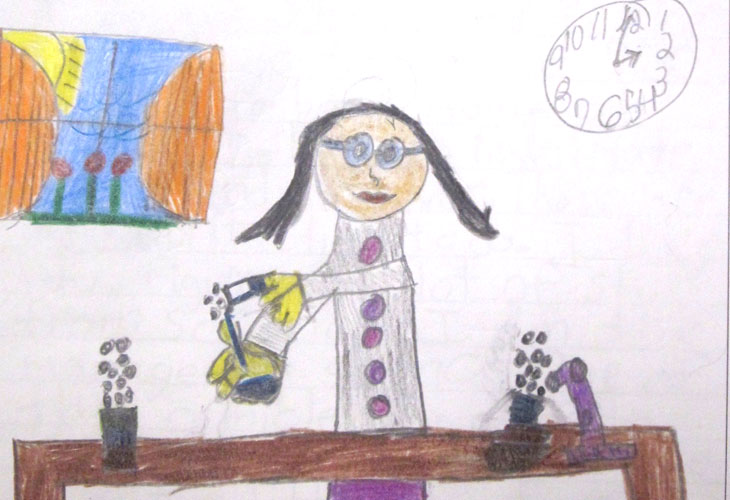
You are a GUI agent. You are given a task and a screenshot of the screen. Output one action in this format:
    pyautogui.click(x=<x>, y=<y>)
    Task: Click on the "3" in clock
    
    Given the screenshot: What is the action you would take?
    pyautogui.click(x=660, y=78)